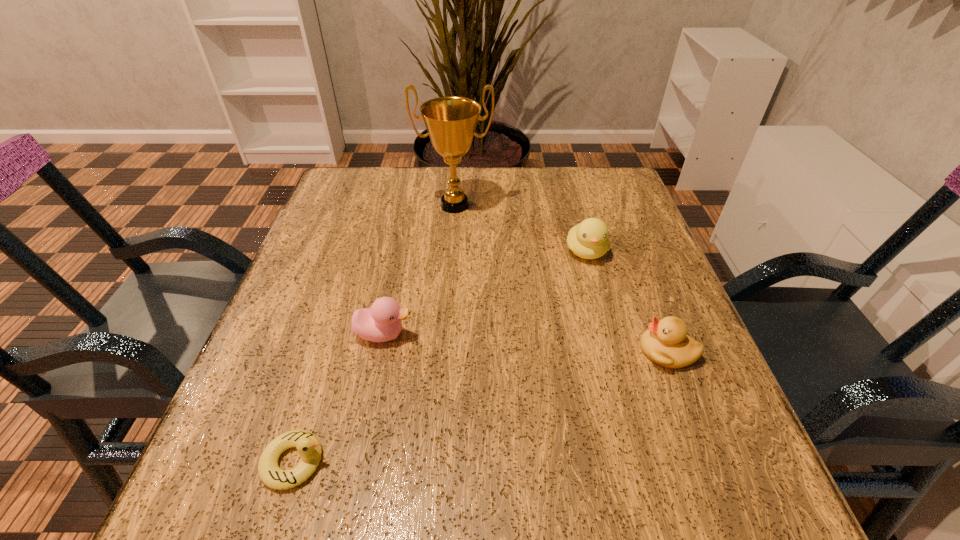
You are a GUI agent. You are given a task and a screenshot of the screen. Output one action in this format:
    pyautogui.click(x=<x>, y=<y>)
    Task: Click on the award
    
    Given the screenshot: What is the action you would take?
    pyautogui.click(x=451, y=121)

Image resolution: width=960 pixels, height=540 pixels. Identify the location of the farthest object. (451, 121).

At what (x,y) coordinates should I click in order to perform the action: click on the second object from right to left. Please return your answer as a coordinate pair (x, y). Image resolution: width=960 pixels, height=540 pixels. Looking at the image, I should click on (589, 239).

The image size is (960, 540). What are the coordinates of `the farthest duckling` in the screenshot? It's located at (589, 239).

Locate an element on the screen. the second shortest object is located at coordinates (666, 342).

The image size is (960, 540). In order to click on the rightmost duckling in this screenshot , I will do `click(666, 342)`.

Where is `the shortest object`? the shortest object is located at coordinates (308, 446).

Identify the location of the nearest duckling. This screenshot has width=960, height=540. (308, 446).

The width and height of the screenshot is (960, 540). Identify the location of vacant area located on the front view with handles of the farthest object. (452, 245).

Image resolution: width=960 pixels, height=540 pixels. I want to click on vacant space positioned 0.290m at the beak of the third duckling from left to right, so click(624, 387).